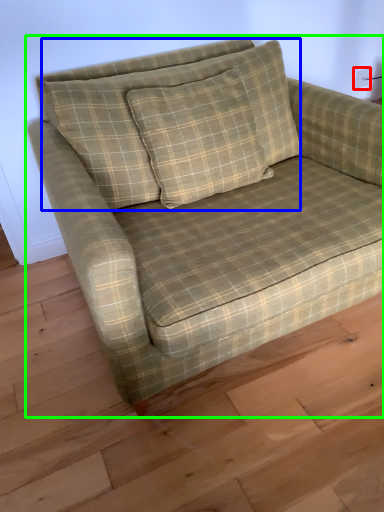
Question: Considering the real-world distances, which object is farthest from electric outlet (highlighted by a red box)? pillow (highlighted by a blue box) or studio couch (highlighted by a green box)?

Choices:
 (A) pillow
 (B) studio couch

Answer: (B)